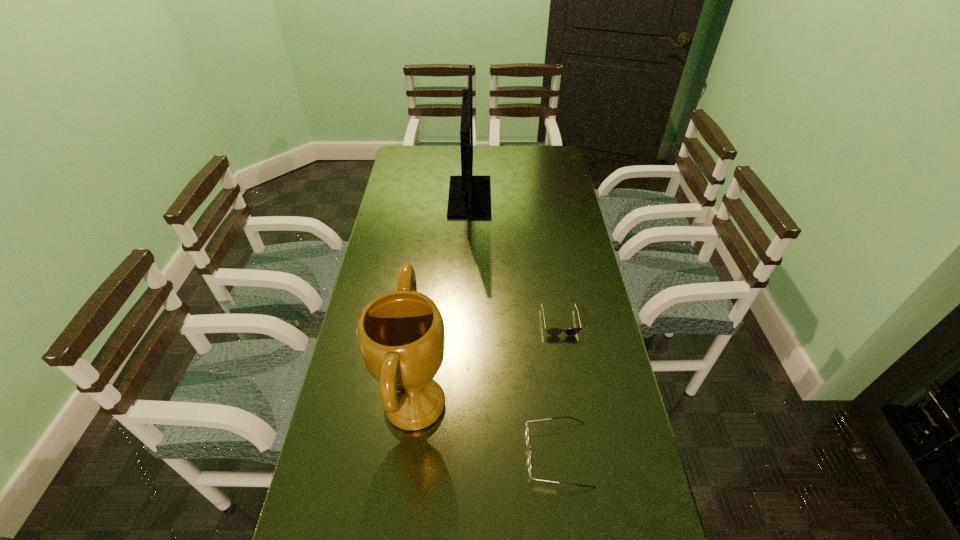
This screenshot has height=540, width=960. I want to click on vacant space at the far right corner of the desktop, so click(540, 167).

Where is `free point between the tallest object and the shortest object`? free point between the tallest object and the shortest object is located at coordinates (515, 259).

In order to click on blank region between the spectacles and the second tallest object in this screenshot , I will do `click(487, 429)`.

Find the location of `free spot between the farthest object and the sunglasses`. free spot between the farthest object and the sunglasses is located at coordinates (515, 259).

This screenshot has width=960, height=540. Identify the location of free spot between the tallest object and the spectacles. (514, 326).

I want to click on vacant area that lies between the award and the second shortest object, so click(487, 429).

I want to click on free space between the monitor and the third tallest object, so click(514, 326).

Where is `free spot between the monitor and the third shortest object`? Image resolution: width=960 pixels, height=540 pixels. free spot between the monitor and the third shortest object is located at coordinates (443, 301).

The image size is (960, 540). Find the location of `unoccupied position between the monitor and the award`. unoccupied position between the monitor and the award is located at coordinates (443, 301).

Find the location of a particular element. empty space between the third tallest object and the second farthest object is located at coordinates (559, 388).